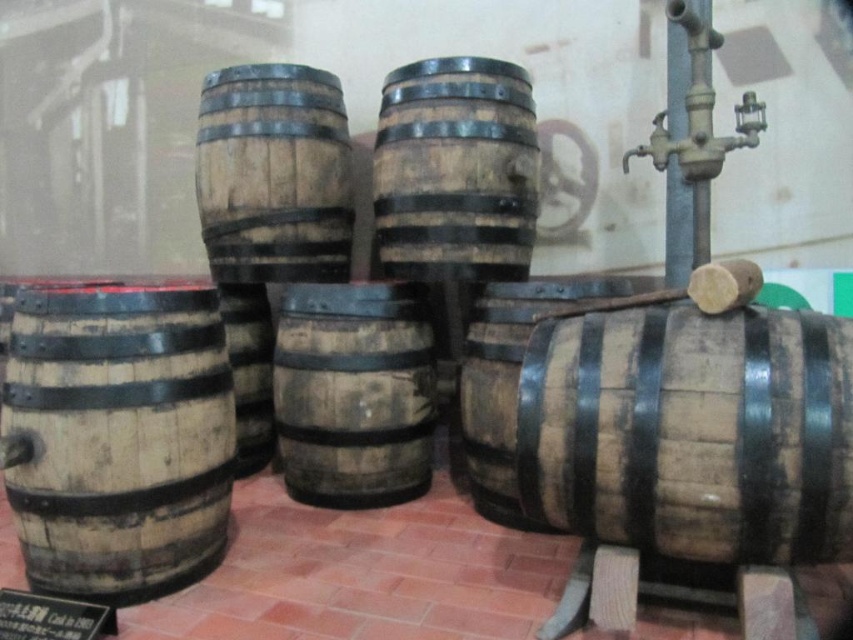
You are a delivery person who needs to move a new barrel that is 3 feet wide into the space between the wooden barrel at left and the weathered wood barrel at center. Can the new barrel fit in that space?

The wooden barrel at left and weathered wood barrel at center are 3.45 feet apart, so the new barrel which is 3 feet wide can fit in the space between them since 3.45 feet is wider than 3 feet.

You are standing in the room with wooden barrels. There is a point at coordinate (117, 438). What object is located at that point?

The point at coordinate (117, 438) indicates the wooden barrel at left.